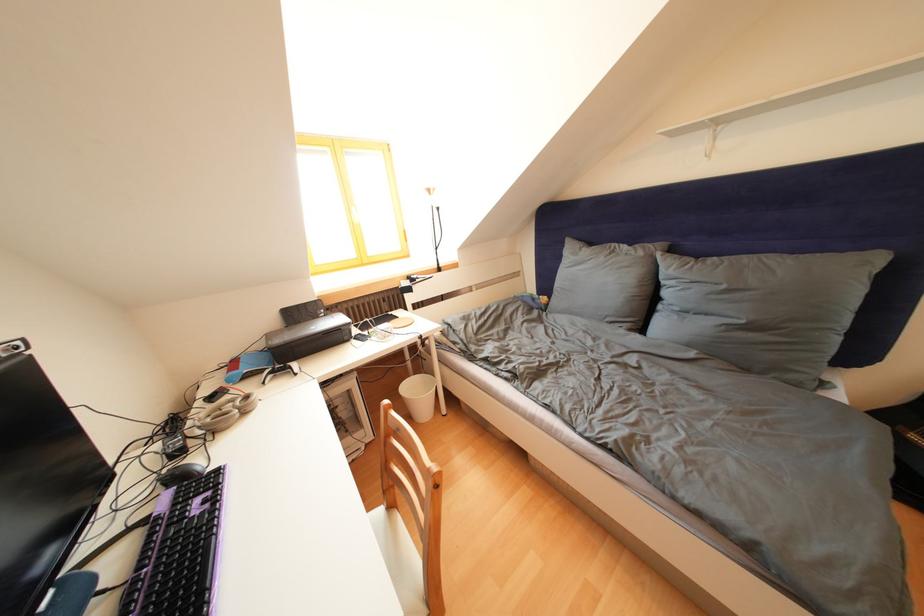
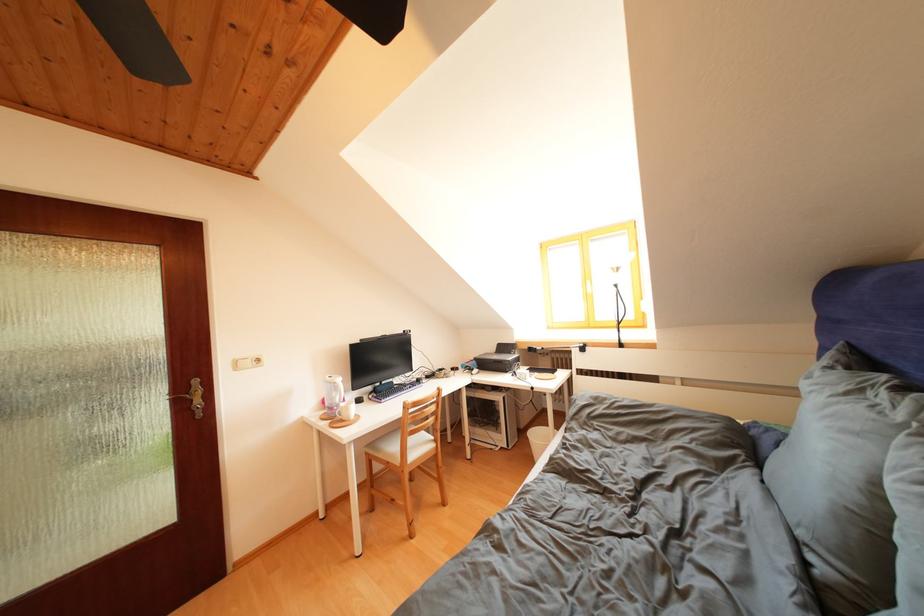
The point at (323, 322) is marked in the first image. Where is the corresponding point in the second image?

(517, 358)